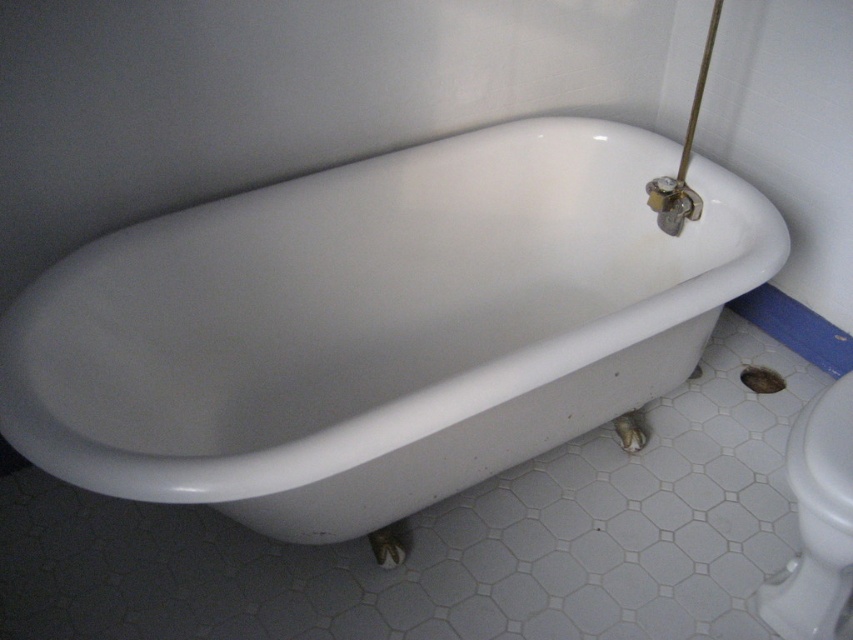
Question: Does white glossy bathtub at center appear under white glossy toilet bowl at lower right?

Choices:
 (A) yes
 (B) no

Answer: (B)

Question: Which of the following is the farthest from the observer?

Choices:
 (A) white glossy bathtub at center
 (B) white glossy toilet bowl at lower right

Answer: (B)

Question: Which point appears closest to the camera in this image?

Choices:
 (A) (538, 362)
 (B) (833, 570)

Answer: (A)

Question: Can you confirm if white glossy bathtub at center is smaller than white glossy toilet bowl at lower right?

Choices:
 (A) no
 (B) yes

Answer: (A)

Question: Does white glossy bathtub at center lie behind white glossy toilet bowl at lower right?

Choices:
 (A) yes
 (B) no

Answer: (B)